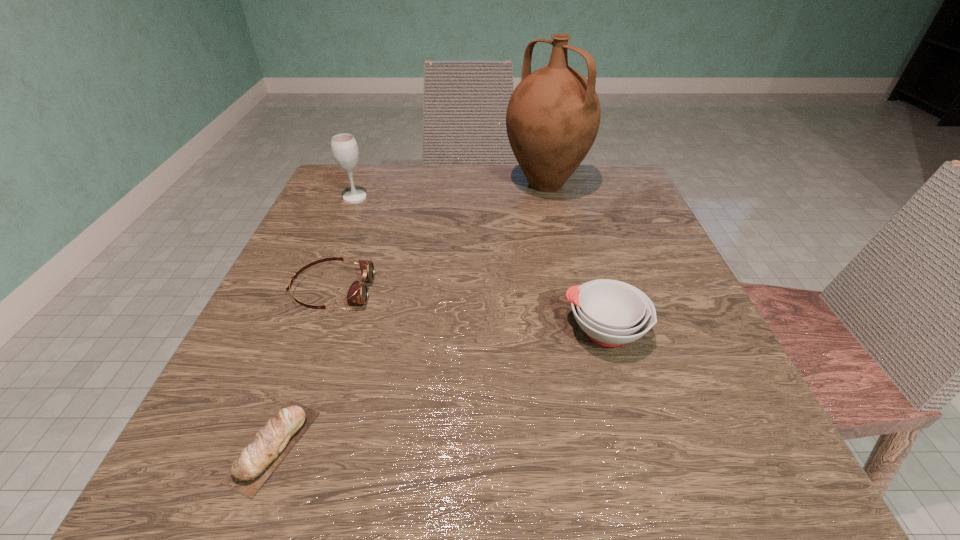
This screenshot has height=540, width=960. What are the coordinates of `pitcher` in the screenshot? It's located at (553, 116).

The width and height of the screenshot is (960, 540). I want to click on wineglass, so click(x=344, y=147).

You are a GUI agent. You are given a task and a screenshot of the screen. Output one action in this format:
    pyautogui.click(x=<x>, y=<y>)
    Task: Click on the third tallest object
    The width and height of the screenshot is (960, 540).
    Given the screenshot: What is the action you would take?
    pyautogui.click(x=612, y=313)

Locate an element on the screen. This screenshot has width=960, height=540. the fourth tallest object is located at coordinates (358, 293).

Where is `the nearest object`? This screenshot has width=960, height=540. the nearest object is located at coordinates (259, 459).

At what (x,y) coordinates should I click in order to perform the action: click on pita bread. Please return your answer as a coordinate pair (x, y). Looking at the image, I should click on (259, 459).

The height and width of the screenshot is (540, 960). I want to click on vacant point located on the front of the tallest object, so click(x=570, y=292).

The width and height of the screenshot is (960, 540). Identify the location of vacant space located 0.140m on the front of the wineglass. (337, 241).

Locate an element on the screen. free space located 0.310m on the back of the soup bowl is located at coordinates (569, 206).

Identify the location of free region located 0.160m through the lenses of the second shortest object. This screenshot has width=960, height=540. (463, 291).